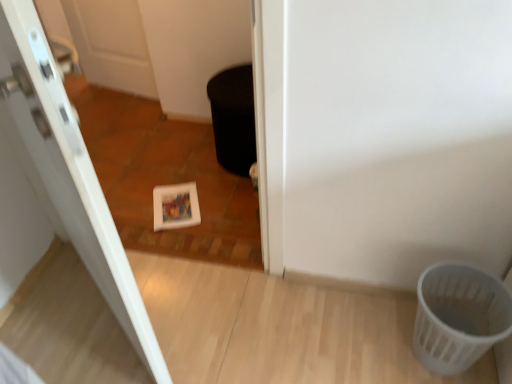
Question: In terms of width, does white plastic basket at lower right look wider or thinner when compared to black matte potty at center?

Choices:
 (A) wide
 (B) thin

Answer: (B)

Question: In terms of height, does white plastic basket at lower right look taller or shorter compared to black matte potty at center?

Choices:
 (A) tall
 (B) short

Answer: (B)

Question: Considering the real-world distances, which object is closest to the white glossy door at upper left?

Choices:
 (A) white plastic basket at lower right
 (B) black matte potty at center

Answer: (B)

Question: Considering the real-world distances, which object is farthest from the white plastic basket at lower right?

Choices:
 (A) black matte potty at center
 (B) white glossy door at upper left

Answer: (A)